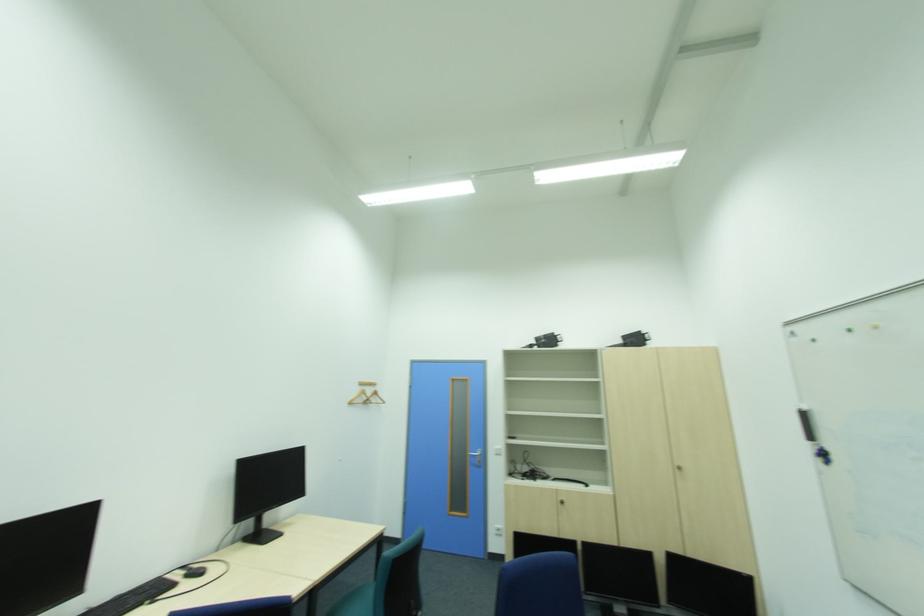
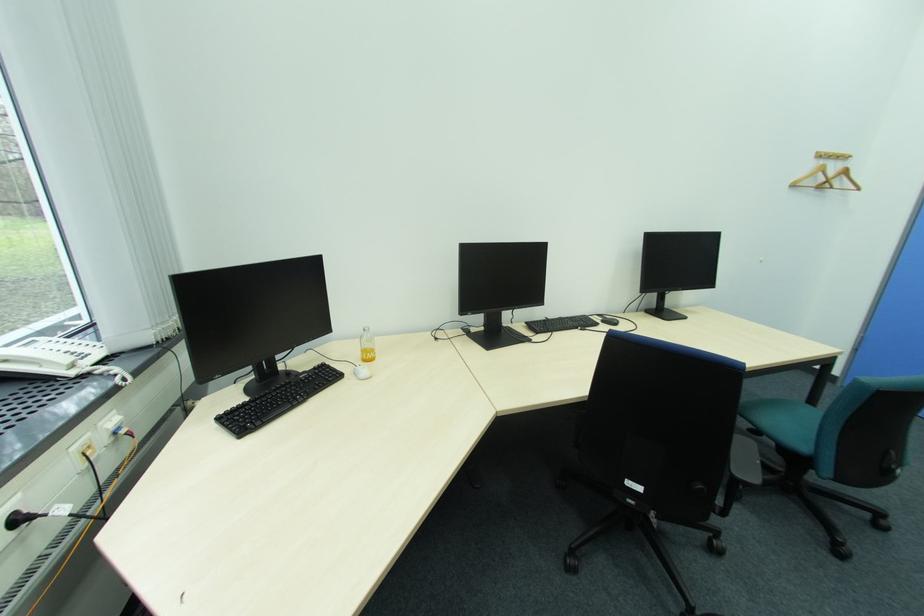
In the second image, find the point that corresponds to point (185, 577) in the first image.

(604, 320)